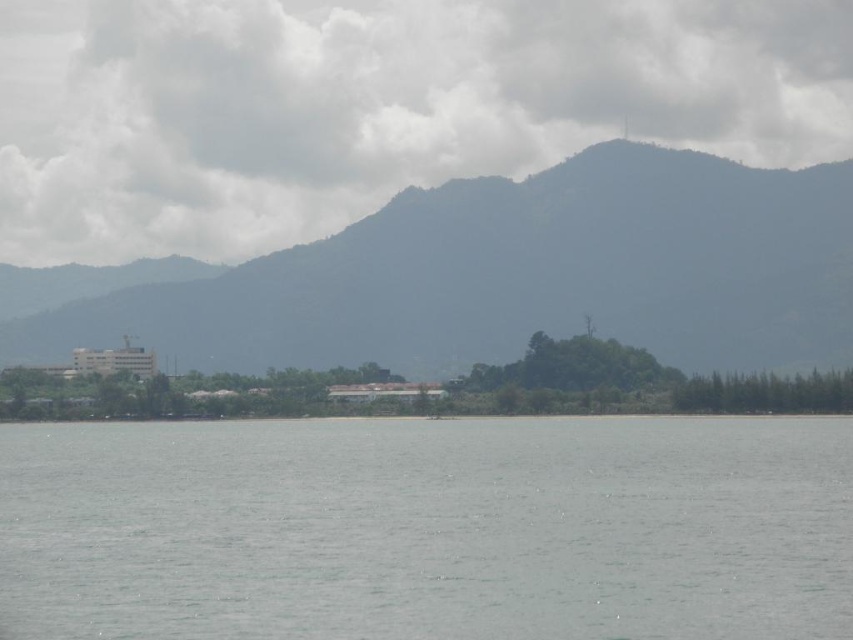
You are a photographer planning to capture the coastal landscape. You want to ensure that both the gray water at center and the green textured mountain at center are clearly visible in your photo. Given their spatial relationship, which object should you prioritize framing first to ensure both are in the shot?

The gray water at center has a lesser width compared to the green textured mountain at center, so you should prioritize framing the wider green textured mountain at center first to ensure both fit into the composition.

You are standing on the shore looking out at the scene. Which object is positioned to the right of the other between the gray water at center and the green textured mountain at center?

The gray water at center is to the right of the green textured mountain at center.

You are a drone operator trying to capture a photo of the gray water at center and the white fluffy cloud at upper center from the same frame. Given that your drone can only maintain a stable flight up to 100 meters away from its current position, can you position the drone in such a way that both objects are within the camera view without exceeding the drone

The distance between the gray water at center and white fluffy cloud at upper center is 127.48 meters, which exceeds the drone